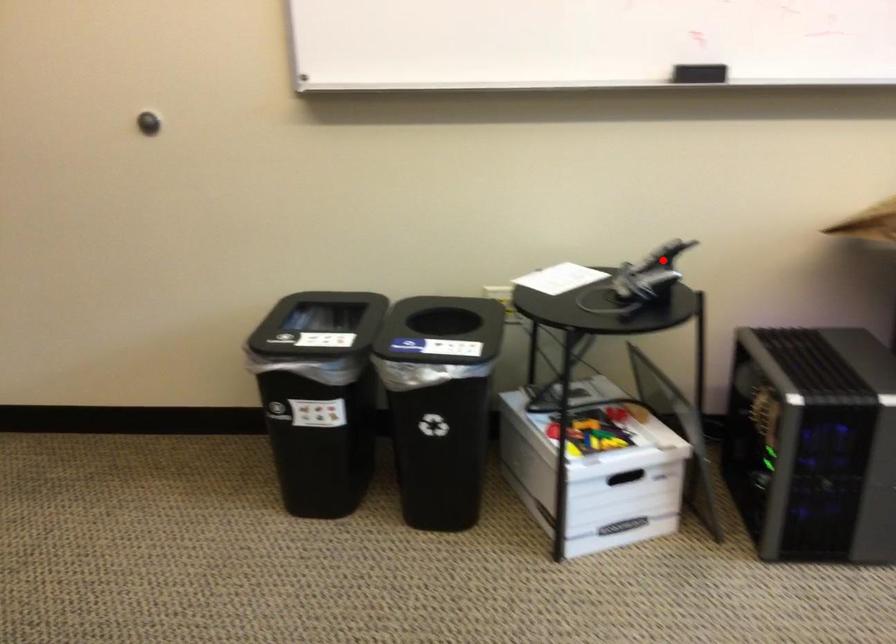
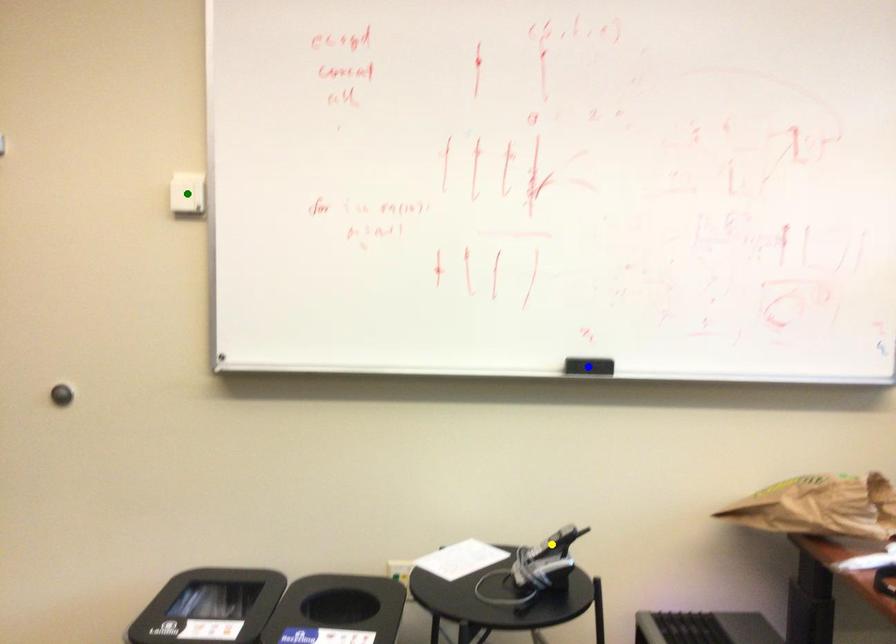
Question: I am providing you with two images of the same scene from different viewpoints. A red point is marked on the first image. You are given multiple points on the second image. Which point in image 2 is actually the same real-world point as the red point in image 1?

Choices:
 (A) blue point
 (B) yellow point
 (C) green point

Answer: (B)